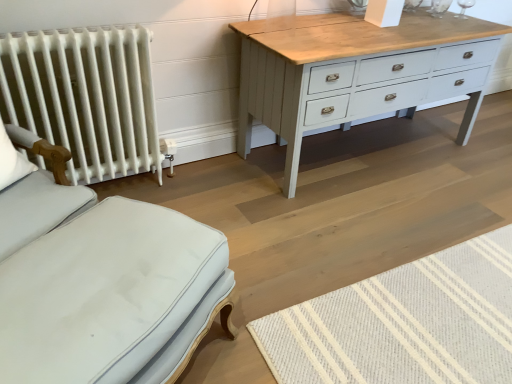
You are a GUI agent. You are given a task and a screenshot of the screen. Output one action in this format:
    pyautogui.click(x=<x>, y=<y>)
    Task: Click on the vacant point above natural wool mat at lower right (from a real-world perspective)
    
    Given the screenshot: What is the action you would take?
    pyautogui.click(x=419, y=331)